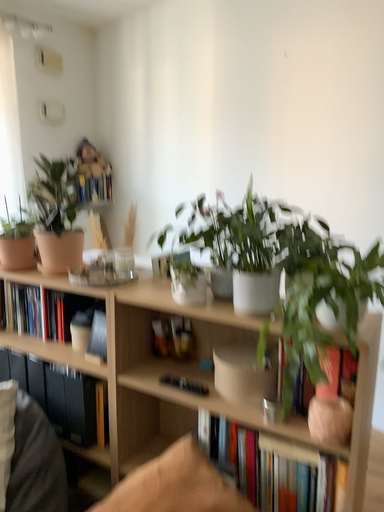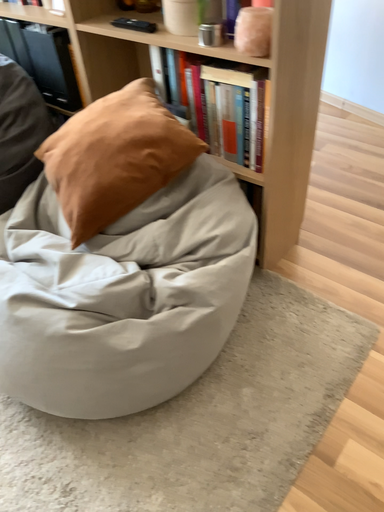
Question: Which way did the camera rotate in the video?

Choices:
 (A) rotated right
 (B) rotated left

Answer: (B)